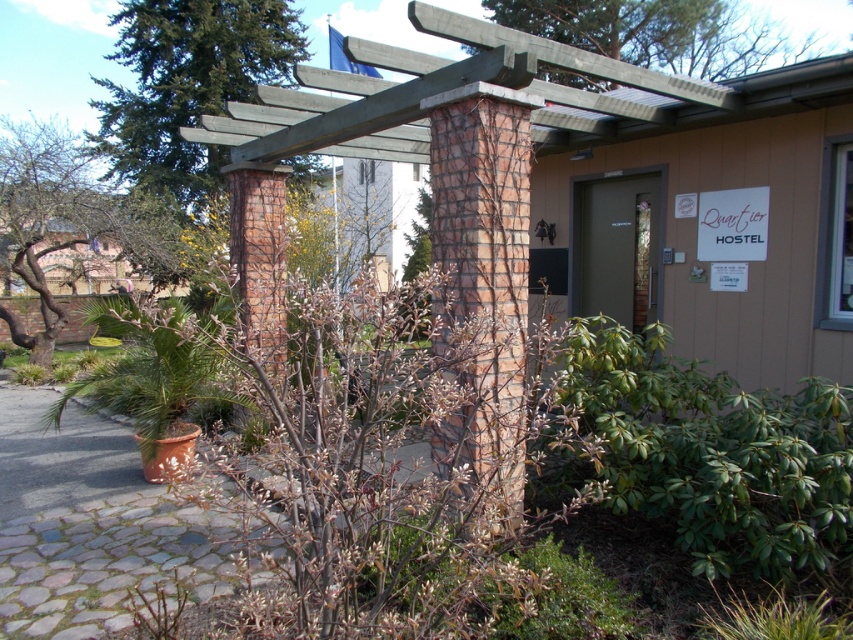
You are standing at the entrance of Quartier Hostel and want to walk to the green leafy tree at left. Which direction should you turn to reach it from the brown cobblestone path at center?

The brown cobblestone path at center is positioned on the right side of green leafy tree at left, so you should turn left from the brown cobblestone path at center to reach the green leafy tree at left.

You are standing at the entrance of Quartier Hostel and want to take a photo of the hostel sign. To avoid having the green leafy tree at left in the frame, where should you position yourself?

Move to the right side of the entrance area to avoid the green leafy tree at left blocking the view of the hostel sign.

You are standing at the pathway under the pergola and looking towards the hostel entrance. Which tree, the green textured tree at upper left or the green leafy tree at left, is positioned more to your left side?

The green textured tree at upper left is positioned more to the left side than the green leafy tree at left.